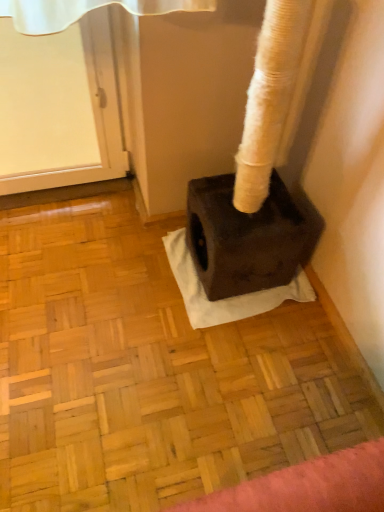
Question: Should I look upward or downward to see dark gray fabric at center?

Choices:
 (A) down
 (B) up

Answer: (A)